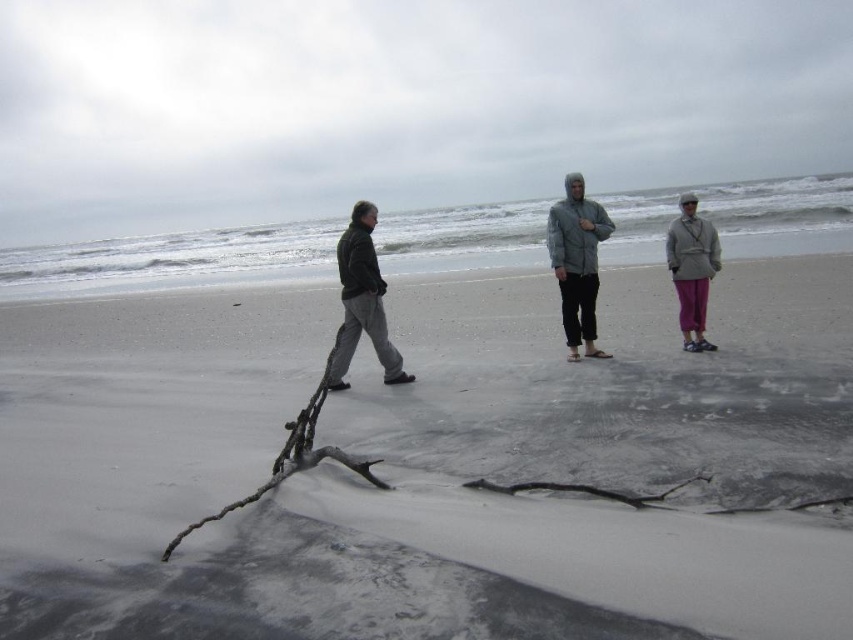
You are a fashion designer observing two jackets in a beach scene. The gray woolen jacket at center and the gray fabric jacket at center are both present. Which jacket has a greater width?

The gray woolen jacket at center has a greater width than the gray fabric jacket at center according to the description.

You are standing at the point labeled point (x=589, y=355) and want to move to the point labeled point (x=585, y=340). Given that you can only move forward in a straight line, will you be moving towards or away from the camera?

Moving from point (x=589, y=355) to point (x=585, y=340) means you are moving away from the camera since point (x=585, y=340) is further away compared to the starting point.

You are standing on the beach and want to place your gray fabric jacket at center on the gray sand at center. Based on the height difference between them, will the jacket be fully visible when placed there?

The gray sand at center has a greater height compared to gray fabric jacket at center, so when placing the jacket on the sand, the sand is higher than the jacket, meaning the jacket will be fully visible as it sits on top of the sand.